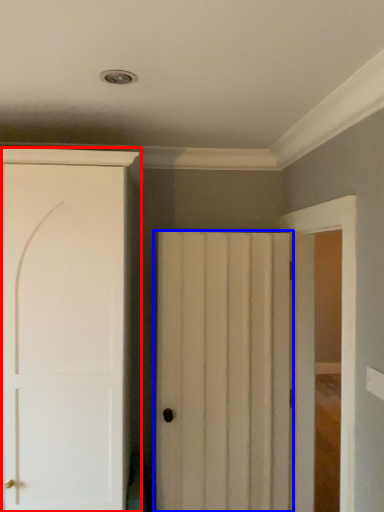
Question: Among these objects, which one is farthest to the camera, door (highlighted by a red box) or door (highlighted by a blue box)?

Choices:
 (A) door
 (B) door

Answer: (B)